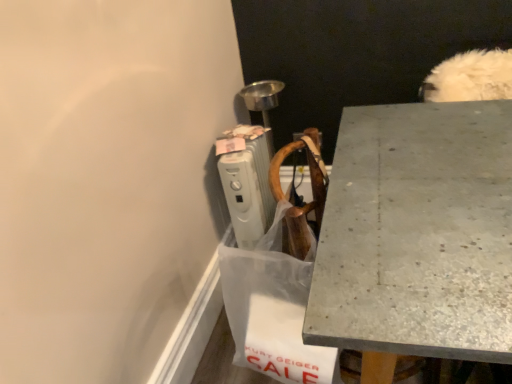
Question: Would you say granite gray desk at upper right is a long distance from white plastic radiator at upper center?

Choices:
 (A) no
 (B) yes

Answer: (A)

Question: From a real-world perspective, is granite gray desk at upper right positioned over white plastic radiator at upper center based on gravity?

Choices:
 (A) no
 (B) yes

Answer: (A)

Question: Is granite gray desk at upper right aimed at white plastic radiator at upper center?

Choices:
 (A) yes
 (B) no

Answer: (B)

Question: Is granite gray desk at upper right wider than white plastic radiator at upper center?

Choices:
 (A) no
 (B) yes

Answer: (B)

Question: Does granite gray desk at upper right have a greater height compared to white plastic radiator at upper center?

Choices:
 (A) no
 (B) yes

Answer: (B)

Question: Is white plastic radiator at upper center surrounded by granite gray desk at upper right?

Choices:
 (A) no
 (B) yes

Answer: (A)

Question: Could granite gray desk at upper right be considered to be inside transparent plastic shopping bag at lower center?

Choices:
 (A) no
 (B) yes

Answer: (A)

Question: From the image's perspective, does transparent plastic shopping bag at lower center appear higher than granite gray desk at upper right?

Choices:
 (A) no
 (B) yes

Answer: (B)

Question: Is transparent plastic shopping bag at lower center thinner than granite gray desk at upper right?

Choices:
 (A) no
 (B) yes

Answer: (B)

Question: Does transparent plastic shopping bag at lower center lie in front of granite gray desk at upper right?

Choices:
 (A) no
 (B) yes

Answer: (A)

Question: Is transparent plastic shopping bag at lower center in contact with granite gray desk at upper right?

Choices:
 (A) yes
 (B) no

Answer: (B)

Question: Considering the relative sizes of transparent plastic shopping bag at lower center and granite gray desk at upper right in the image provided, is transparent plastic shopping bag at lower center smaller than granite gray desk at upper right?

Choices:
 (A) no
 (B) yes

Answer: (B)

Question: From the image's perspective, is white plastic radiator at upper center on top of granite gray desk at upper right?

Choices:
 (A) yes
 (B) no

Answer: (A)